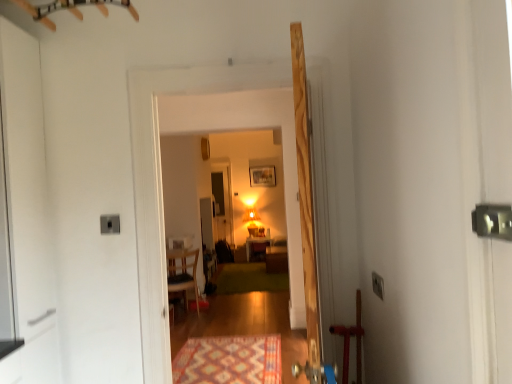
Question: Is green carpet at center, the first mat viewed from the back, bigger or smaller than matte wooden table at center?

Choices:
 (A) big
 (B) small

Answer: (B)

Question: From their relative heights in the image, would you say green carpet at center, the first mat viewed from the back, is taller or shorter than matte wooden table at center?

Choices:
 (A) short
 (B) tall

Answer: (A)

Question: Which is farther from the green carpet at center, the first mat viewed from the back?

Choices:
 (A) matte wooden table at center
 (B) wooden armchair at center
 (C) matte wooden frame at upper center
 (D) wooden door at center
 (E) wooden floor at center

Answer: (D)

Question: Based on their relative distances, which object is farther from the multicolored woven mat at lower center, which appears as the 2th mat when viewed from the back?

Choices:
 (A) matte wooden table at center
 (B) matte wooden frame at upper center
 (C) wooden floor at center
 (D) wooden armchair at center
 (E) green carpet at center, positioned as the 2th mat in front-to-back order

Answer: (B)